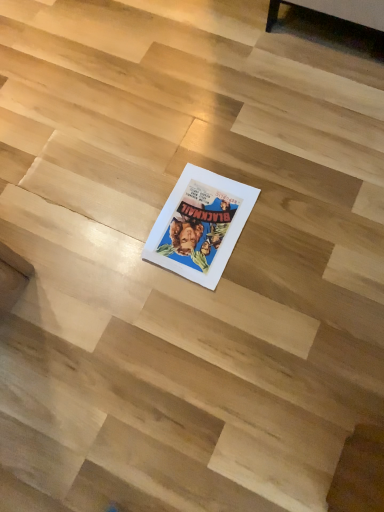
The height and width of the screenshot is (512, 384). What are the coordinates of `vacant area situated below white paper book at center (from a real-world perspective)` in the screenshot? It's located at (198, 228).